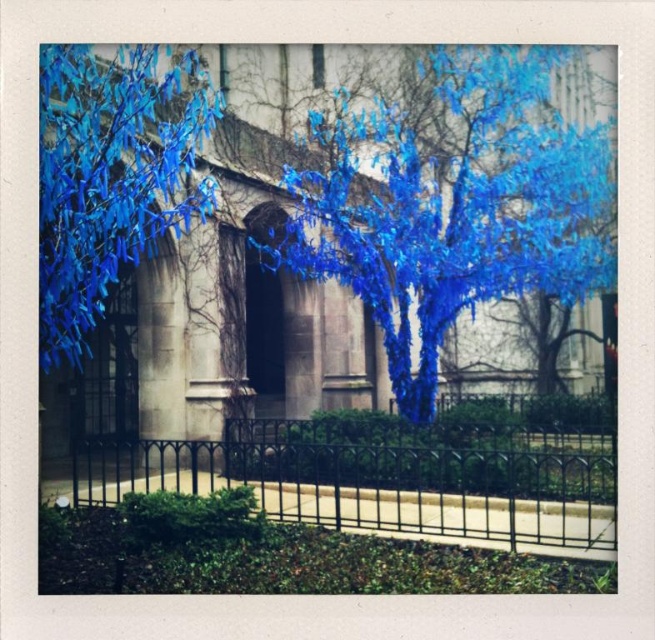
From the picture: Can you confirm if blue glossy tree at center is wider than black wrought iron fence at center?

Correct, the width of blue glossy tree at center exceeds that of black wrought iron fence at center.

Between blue glossy tree at center and black wrought iron fence at center, which one appears on the left side from the viewer's perspective?

Positioned to the left is blue glossy tree at center.

Is point (476, 218) positioned after point (445, 470)?

Yes.

Where is `blue glossy tree at center`? The height and width of the screenshot is (640, 655). blue glossy tree at center is located at coordinates click(x=453, y=200).

From the picture: Does blue glossy tree at center appear over blue glossy leaves at upper left?

Yes, blue glossy tree at center is above blue glossy leaves at upper left.

Does blue glossy tree at center appear on the left side of blue glossy leaves at upper left?

In fact, blue glossy tree at center is to the right of blue glossy leaves at upper left.

You are a GUI agent. You are given a task and a screenshot of the screen. Output one action in this format:
    pyautogui.click(x=<x>, y=<y>)
    Task: Click on the blue glossy tree at center
    
    Given the screenshot: What is the action you would take?
    pyautogui.click(x=453, y=200)

Based on the photo, who is more forward, (x=358, y=468) or (x=83, y=84)?

Positioned in front is point (x=83, y=84).

Can you confirm if black wrought iron fence at center is positioned to the right of blue glossy leaves at upper left?

Yes, black wrought iron fence at center is to the right of blue glossy leaves at upper left.

Find the location of `black wrought iron fence at center`. black wrought iron fence at center is located at coordinates (383, 484).